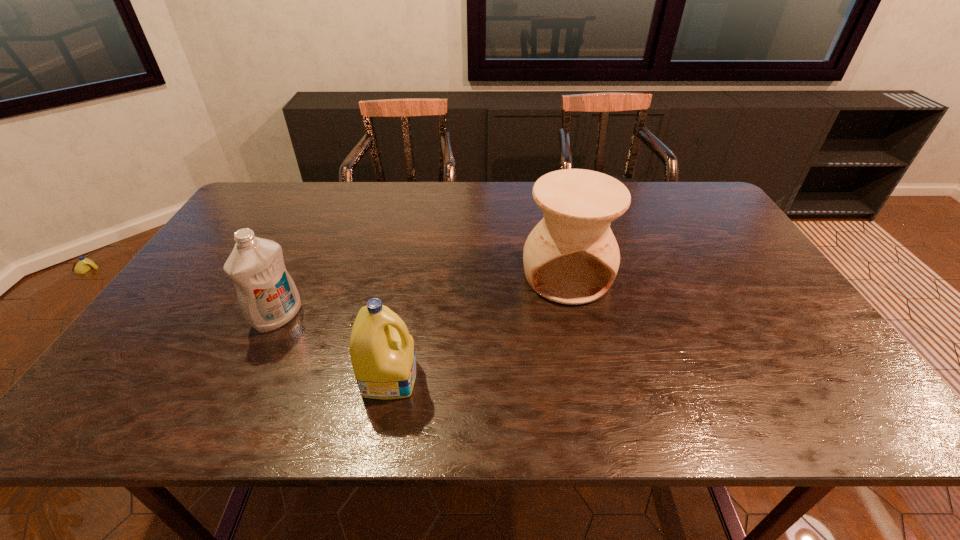
The width and height of the screenshot is (960, 540). In the image, there is a desktop. In order to click on free region at the near edge in this screenshot , I will do `click(222, 401)`.

Identify the location of free space at the left edge of the desktop. (193, 352).

In the image, there is a desktop. Find the location of `vacant space at the far left corner`. vacant space at the far left corner is located at coordinates (241, 211).

What are the coordinates of `free region at the near left corner of the desktop` in the screenshot? It's located at (140, 404).

Where is `free space at the far right corner of the desktop`? The height and width of the screenshot is (540, 960). free space at the far right corner of the desktop is located at coordinates (693, 184).

This screenshot has height=540, width=960. What are the coordinates of `free space between the left detergent and the nearer detergent` in the screenshot? It's located at (333, 347).

Locate an element on the screen. unoccupied area between the pottery and the shortest object is located at coordinates [478, 327].

The image size is (960, 540). Identify the location of free spot between the farther detergent and the second object from right to left. (333, 347).

The image size is (960, 540). Find the location of `vacant area that lies between the farther detergent and the rightmost object`. vacant area that lies between the farther detergent and the rightmost object is located at coordinates (422, 297).

Find the location of `empty space between the second object from left to right and the farther detergent`. empty space between the second object from left to right and the farther detergent is located at coordinates (333, 347).